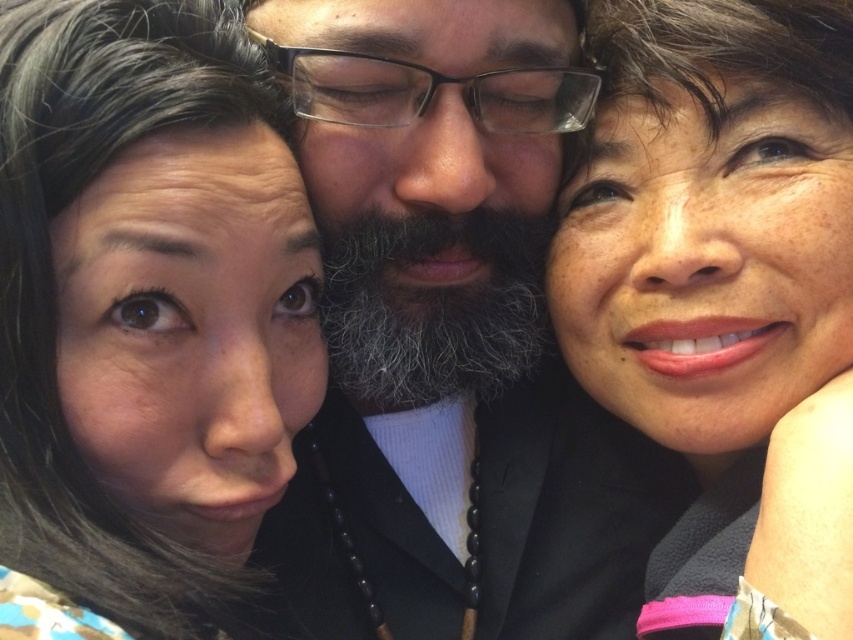
Based on the photo, can you confirm if smooth skin face at upper right is positioned below gray/white/fuzzy beard at center?

Actually, smooth skin face at upper right is above gray/white/fuzzy beard at center.

Can you confirm if smooth skin face at upper right is positioned to the left of gray/white/fuzzy beard at center?

No, smooth skin face at upper right is not to the left of gray/white/fuzzy beard at center.

Is point (672, 243) more distant than point (480, 321)?

No, it is in front of (480, 321).

The image size is (853, 640). What are the coordinates of `smooth skin face at upper right` in the screenshot? It's located at (721, 285).

Looking at this image, which is more to the left, smooth black beard at center or smooth skin face at upper right?

From the viewer's perspective, smooth black beard at center appears more on the left side.

Is the position of smooth black beard at center less distant than that of smooth skin face at upper right?

No, smooth black beard at center is further to the viewer.

Is point (363, 29) positioned after point (741, 588)?

Yes, it is.

Locate an element on the screen. smooth black beard at center is located at coordinates (451, 336).

The height and width of the screenshot is (640, 853). What do you see at coordinates (451, 336) in the screenshot?
I see `smooth black beard at center` at bounding box center [451, 336].

Is point (587, 468) positioned after point (144, 326)?

Yes, it is.

Is point (521, 476) behind point (143, 45)?

Yes, point (521, 476) is behind point (143, 45).

Locate an element on the screen. The width and height of the screenshot is (853, 640). smooth black beard at center is located at coordinates (451, 336).